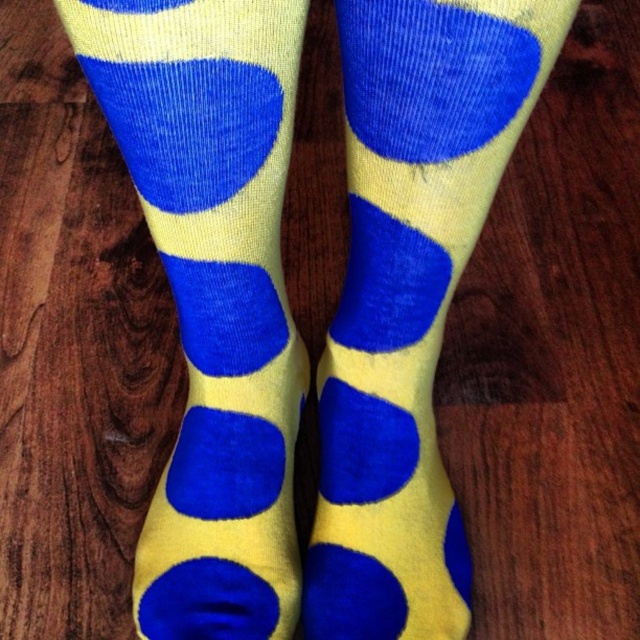
Which is more to the right, yellow corduroy socks at center or matte yellow socks at center?

From the viewer's perspective, matte yellow socks at center appears more on the right side.

Does point (177, 483) come closer to viewer compared to point (460, 12)?

No.

Where is `yellow corduroy socks at center`? This screenshot has width=640, height=640. yellow corduroy socks at center is located at coordinates (212, 294).